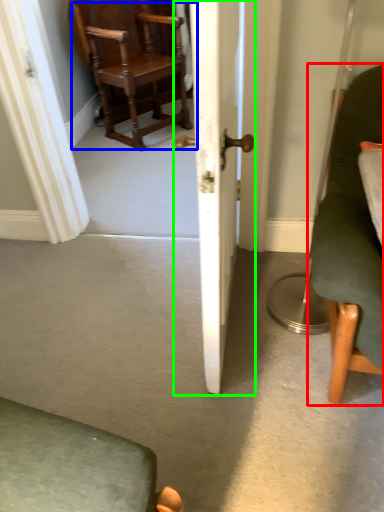
Question: Which object is positioned closest to chair (highlighted by a red box)? Select from chair (highlighted by a blue box) and door (highlighted by a green box).

Choices:
 (A) chair
 (B) door

Answer: (B)